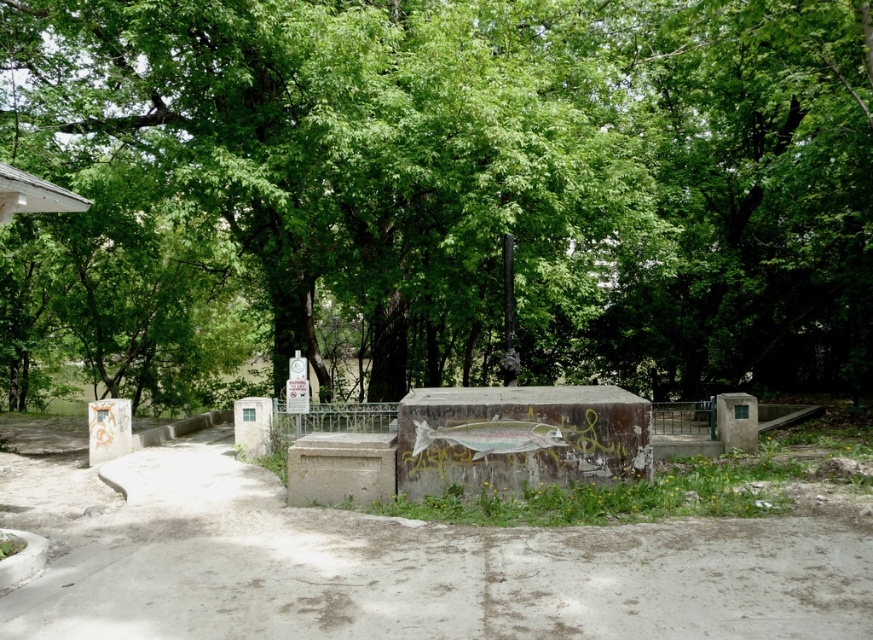
From the picture: You are planning to place a picnic blanket between the green leafy tree at center and the concrete at center. Based on their widths, which object should you position closer to the narrower side to ensure the blanket fits properly?

Since the green leafy tree at center is wider than the concrete at center, you should position the picnic blanket closer to the concrete at center, which is narrower, to ensure it fits properly.

You are standing at the point marked by the coordinates point [440,192]. Looking around, you see the concrete structure with graffiti and the paved path leading to it. Which direction should you walk to reach the concrete structure with graffiti?

The point [440,192] is located at the green leafy tree at center. To reach the concrete structure with graffiti, you should walk towards the paved path leading up to it, which is in the direction away from the tree towards the structure.

You are a park visitor who wants to take a photo of the concrete at center without the green leafy tree at center blocking the view. Is there a way to do this by moving closer or farther away from the structure?

The green leafy tree at center is much taller than the concrete at center, so moving closer to the concrete at center might help reduce the tree from blocking the view, but since the tree is taller, you might still need to position yourself at an angle where the tree is out of frame or lower your camera angle to avoid the tree obstructing the concrete structure.